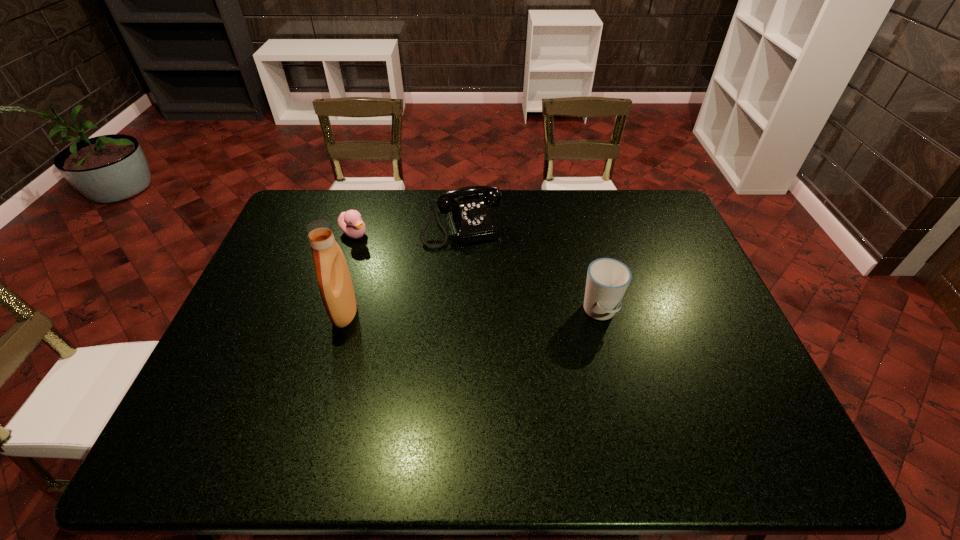
Locate an element on the screen. The height and width of the screenshot is (540, 960). vacant position located 0.260m on the front-facing side of the shortest object is located at coordinates (420, 276).

Where is `free space located on the dial of the third object from left to right`? Image resolution: width=960 pixels, height=540 pixels. free space located on the dial of the third object from left to right is located at coordinates click(x=490, y=304).

Locate an element on the screen. The image size is (960, 540). vacant area situated 0.360m on the dial of the third object from left to right is located at coordinates pos(501,338).

The image size is (960, 540). I want to click on vacant position located on the dial of the third object from left to right, so click(x=481, y=280).

Where is `duckling at the far edge`? Image resolution: width=960 pixels, height=540 pixels. duckling at the far edge is located at coordinates coord(350,222).

The width and height of the screenshot is (960, 540). In order to click on telephone at the far edge in this screenshot , I will do `click(471, 221)`.

Where is `free space at the far edge of the desktop`? This screenshot has height=540, width=960. free space at the far edge of the desktop is located at coordinates (564, 200).

Identify the location of free space at the near edge of the desktop. Image resolution: width=960 pixels, height=540 pixels. (610, 396).

Locate an element on the screen. blank area at the left edge is located at coordinates (216, 367).

Image resolution: width=960 pixels, height=540 pixels. In the image, there is a desktop. Find the location of `vacant space at the right edge`. vacant space at the right edge is located at coordinates (690, 255).